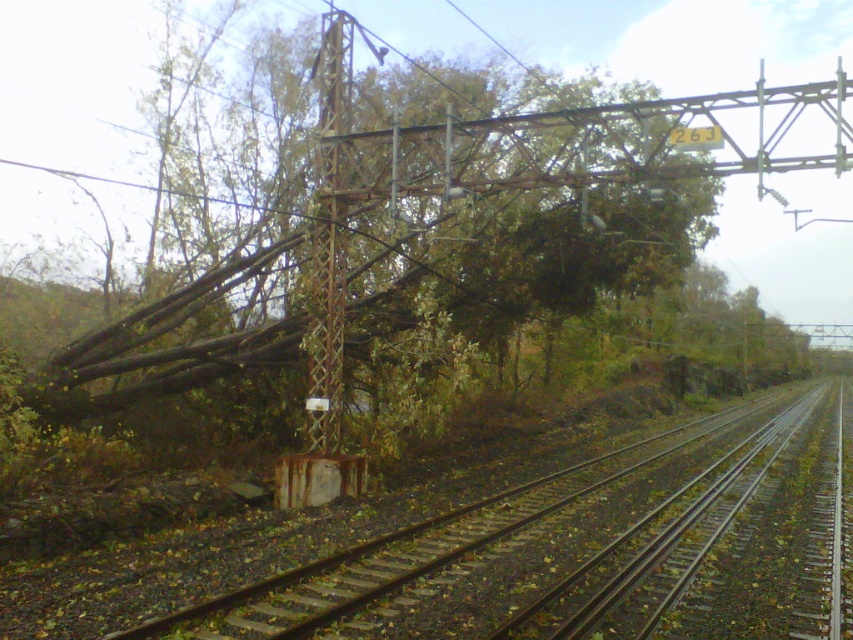
Question: Which of the following is the closest to the observer?

Choices:
 (A) (276, 205)
 (B) (444, 632)

Answer: (B)

Question: Among these points, which one is farthest from the camera?

Choices:
 (A) (335, 307)
 (B) (450, 202)
 (C) (722, 481)

Answer: (B)

Question: Is brown wood tree at center positioned behind rusty metal train track at left?

Choices:
 (A) yes
 (B) no

Answer: (A)

Question: Which of the following is the farthest from the observer?

Choices:
 (A) rusty metal pole at center
 (B) brown wood tree at center
 (C) rusty metal train track at left

Answer: (A)

Question: Does rusty metal train track at left have a lesser width compared to rusty metal pole at center?

Choices:
 (A) yes
 (B) no

Answer: (B)

Question: Can you confirm if brown wood tree at center is bigger than rusty metal pole at center?

Choices:
 (A) no
 (B) yes

Answer: (B)